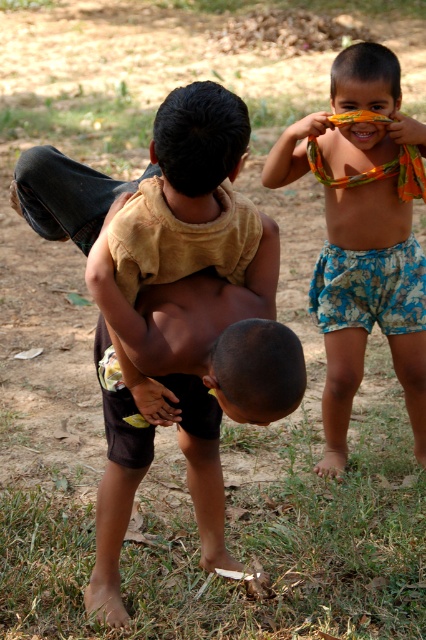
Question: Does brown cotton shirt at center have a smaller size compared to floral shorts at right?

Choices:
 (A) yes
 (B) no

Answer: (B)

Question: Which point is farther to the camera?

Choices:
 (A) brown matte nose at center
 (B) brown cotton shirt at center

Answer: (A)

Question: Does brown cotton shirt at center have a greater width compared to floral shorts at right?

Choices:
 (A) no
 (B) yes

Answer: (A)

Question: Which is nearer to the brown cotton shirt at center?

Choices:
 (A) floral shorts at right
 (B) brown matte nose at center

Answer: (B)

Question: Based on their relative distances, which object is farther from the floral shorts at right?

Choices:
 (A) brown cotton shirt at center
 (B) brown matte nose at center

Answer: (B)

Question: Is floral shorts at right positioned before brown matte nose at center?

Choices:
 (A) yes
 (B) no

Answer: (B)